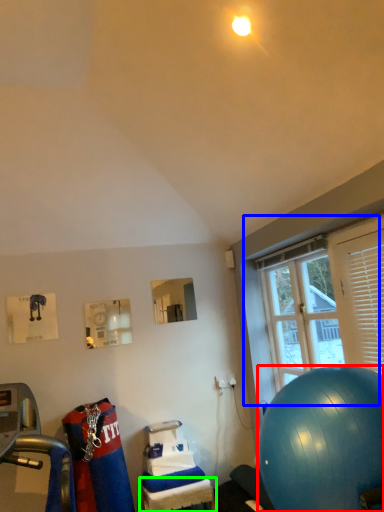
Question: Which is farther away from ball (highlighted by a red box)? window (highlighted by a blue box) or table (highlighted by a green box)?

Choices:
 (A) window
 (B) table

Answer: (B)